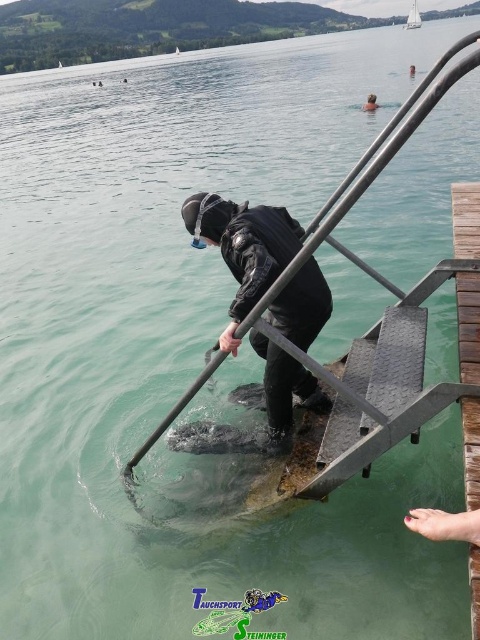
You are a lifeguard observing the lakeside scene. You notice the black matte diving suit at center and the smooth skin foot at lower right. Which object is taller in the image?

The black matte diving suit at center is taller than the smooth skin foot at lower right according to the description.

You are a lifeguard observing the lakeside scene. You notice the smooth skin foot at lower right and the white plastic boat at upper center. Which object is positioned lower in the image?

The smooth skin foot at lower right is positioned lower in the image than the white plastic boat at upper center.